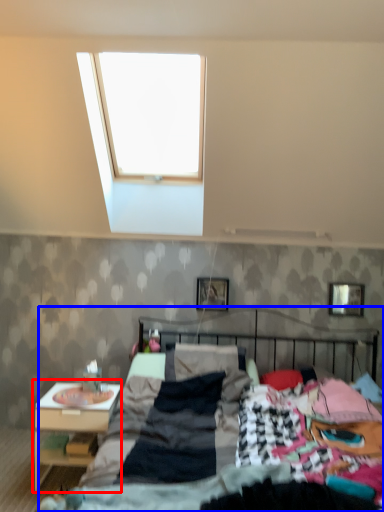
Question: Which object appears farthest to the camera in this image, nightstand (highlighted by a red box) or bed (highlighted by a blue box)?

Choices:
 (A) nightstand
 (B) bed

Answer: (A)